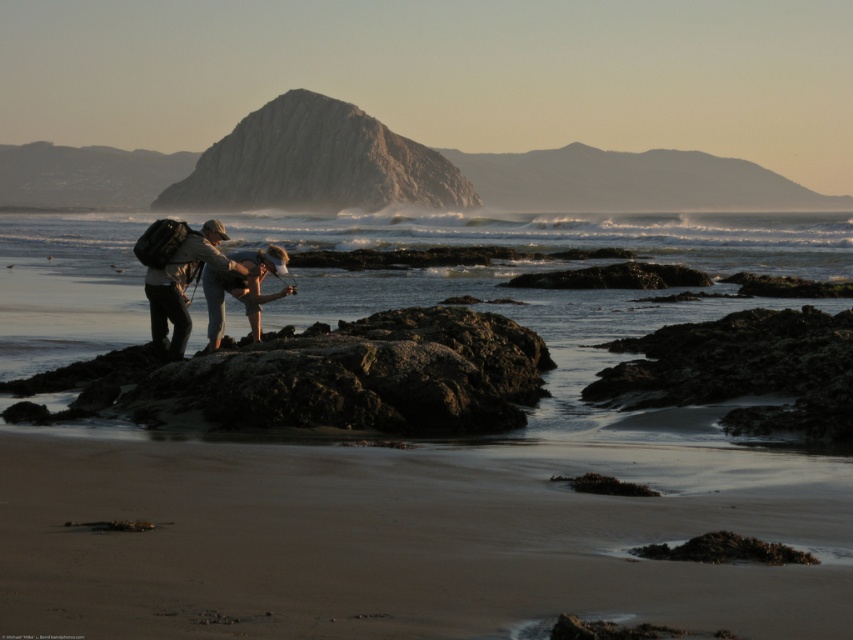
You are a photographer trying to capture a photo of the rugged granite rock at center and the matte khaki pants at center. Based on their heights, which object should you focus on first if you want to ensure both are in the frame without moving the camera?

The rugged granite rock at center is taller than the matte khaki pants at center, so you should focus on the rugged granite rock at center first to ensure both are in frame.

Consider the image. You are standing on the beach and see the smooth sand beach at center and the matte khaki pants at center. Which object is positioned to the right of the other?

The smooth sand beach at center is to the right of the matte khaki pants at center.

You are a photographer trying to capture a wide landscape shot of the smooth sand beach at center. Your camera is set up on a tripod. To ensure the entire beach fits in the frame, you need to be at least 25 feet away from it. Based on the scene description, can you confirm if you are positioned far enough?

The distance between you and the smooth sand beach at center is 25.59 feet, which is just over the required 25 feet. Therefore, you are positioned far enough to capture the entire beach in your wide landscape shot.